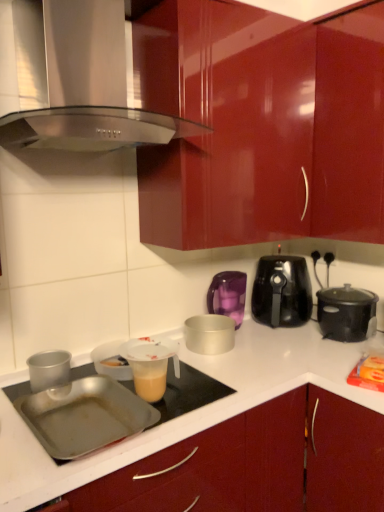
You are a GUI agent. You are given a task and a screenshot of the screen. Output one action in this format:
    pyautogui.click(x=<x>, y=<y>)
    Task: Click on the vacant region to the left of black plastic slow cooker at right, placed as the first kitchen appliance when sorted from right to left
    
    Given the screenshot: What is the action you would take?
    pyautogui.click(x=300, y=344)